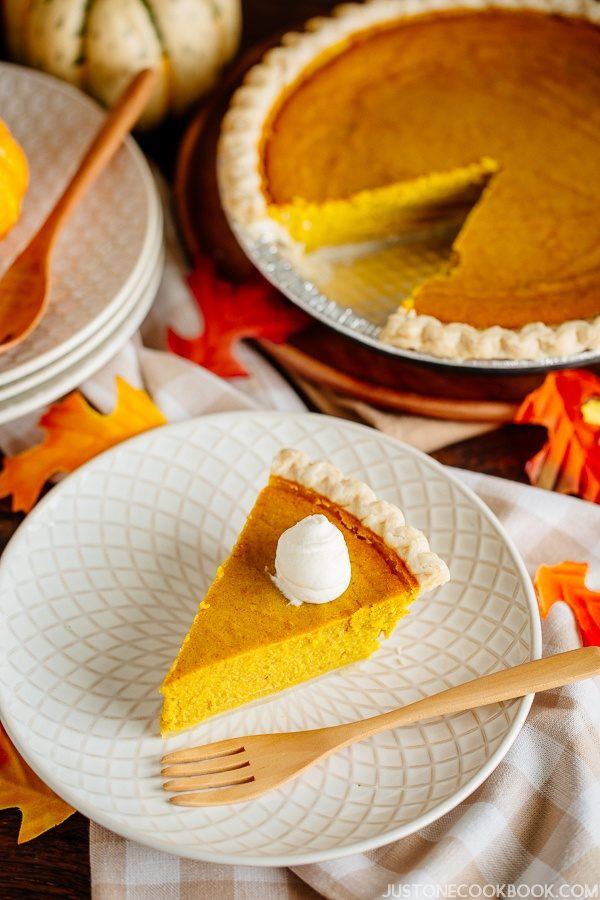
This screenshot has height=900, width=600. Find the location of `tabletop`. tabletop is located at coordinates (496, 463), (35, 858).